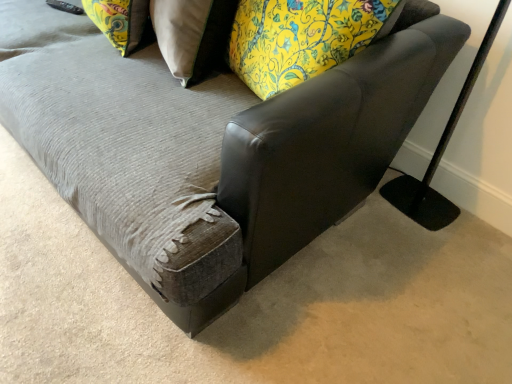
Where is `vacant space underneath black matte table lamp at right (from a real-world perspective)`? Image resolution: width=512 pixels, height=384 pixels. vacant space underneath black matte table lamp at right (from a real-world perspective) is located at coordinates (412, 203).